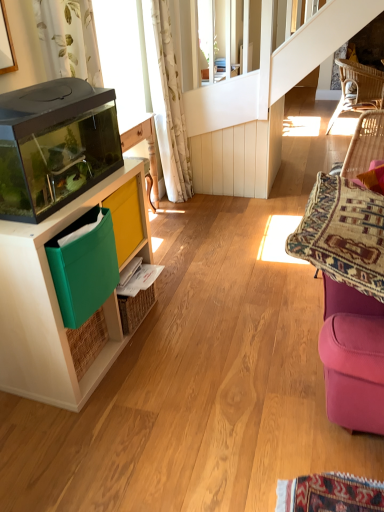
Question: Visually, is green plastic bin at left positioned to the left or to the right of white floral fabric curtain at upper left?

Choices:
 (A) right
 (B) left

Answer: (B)

Question: Is green plastic bin at left bigger or smaller than white floral fabric curtain at upper left?

Choices:
 (A) big
 (B) small

Answer: (B)

Question: Which object is positioned closest to the green plastic bin at left?

Choices:
 (A) velvet purple swivel chair at right
 (B) matte wood cabinet at left
 (C) white floral fabric curtain at upper left
 (D) woven rattan chair at upper right
 (E) transparent glass aquarium at left

Answer: (B)

Question: Based on their relative distances, which object is nearer to the woven rattan chair at upper right?

Choices:
 (A) white floral fabric curtain at upper left
 (B) green plastic bin at left
 (C) matte wood cabinet at left
 (D) velvet purple swivel chair at right
 (E) transparent glass aquarium at left

Answer: (A)